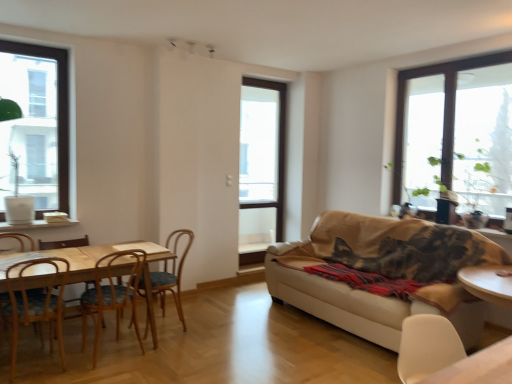
Question: Is wooden table at left turned away from clear glass window at center, which is counted as the 2th window, starting from the right?

Choices:
 (A) no
 (B) yes

Answer: (A)

Question: From the image's perspective, is wooden table at left under clear glass window at center, the second window from the left?

Choices:
 (A) yes
 (B) no

Answer: (A)

Question: Is wooden table at left not inside clear glass window at center, which is counted as the 2th window, starting from the right?

Choices:
 (A) yes
 (B) no

Answer: (A)

Question: Would you say clear glass window at center, the third window in the front-to-back sequence, is part of wooden table at left's contents?

Choices:
 (A) yes
 (B) no

Answer: (B)

Question: From a real-world perspective, is wooden table at left physically above clear glass window at center, which is counted as the 2th window, starting from the right?

Choices:
 (A) no
 (B) yes

Answer: (A)

Question: From a real-world perspective, is white matte chair at lower right, which is the fifth chair in left-to-right order, above or below wooden chair at left, placed as the first chair when sorted from left to right?

Choices:
 (A) above
 (B) below

Answer: (A)

Question: From the image's perspective, is white matte chair at lower right, which is the fifth chair in back-to-front order, located above or below wooden chair at left, which is the 2th chair from back to front?

Choices:
 (A) above
 (B) below

Answer: (A)

Question: In terms of size, does white matte chair at lower right, which is the fifth chair in back-to-front order, appear bigger or smaller than wooden chair at left, which is the fifth chair from right to left?

Choices:
 (A) big
 (B) small

Answer: (B)

Question: Is point (429, 317) positioned closer to the camera than point (5, 299)?

Choices:
 (A) closer
 (B) farther

Answer: (A)

Question: Does point (414, 331) appear closer or farther from the camera than point (504, 190)?

Choices:
 (A) closer
 (B) farther

Answer: (A)

Question: Is white matte chair at lower right, the first chair positioned from the right, in front of or behind transparent glass window at upper right, which ranks as the 3th window in left-to-right order, in the image?

Choices:
 (A) front
 (B) behind

Answer: (A)

Question: In terms of size, does white matte chair at lower right, which is the fifth chair in back-to-front order, appear bigger or smaller than transparent glass window at upper right, acting as the 1th window starting from the right?

Choices:
 (A) small
 (B) big

Answer: (A)

Question: From the image's perspective, is white matte chair at lower right, which is the fifth chair in left-to-right order, positioned above or below transparent glass window at upper right, the 1th window viewed from the front?

Choices:
 (A) above
 (B) below

Answer: (B)

Question: From the image's perspective, is green leafy plant at right above or below white matte chair at lower right, which is the fifth chair in back-to-front order?

Choices:
 (A) above
 (B) below

Answer: (A)

Question: Considering the positions of green leafy plant at right and white matte chair at lower right, which is the first chair from front to back, in the image, is green leafy plant at right wider or thinner than white matte chair at lower right, which is the first chair from front to back,?

Choices:
 (A) wide
 (B) thin

Answer: (A)